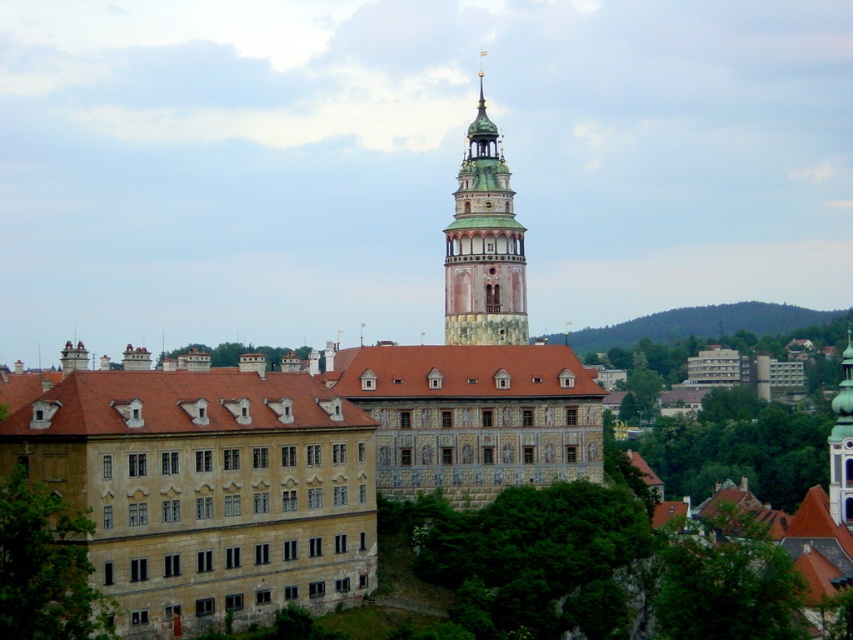
Question: Which object appears farthest from the camera in this image?

Choices:
 (A) green wooden bell tower at center
 (B) brown stone building at center
 (C) green grassy hillside at upper right

Answer: (C)

Question: Does green wooden bell tower at center appear under green grassy hillside at upper right?

Choices:
 (A) no
 (B) yes

Answer: (A)

Question: Can you confirm if green wooden bell tower at center is positioned to the left of green grassy hillside at upper right?

Choices:
 (A) no
 (B) yes

Answer: (B)

Question: Among these points, which one is farthest from the camera?

Choices:
 (A) (67, 408)
 (B) (665, 337)

Answer: (B)

Question: Which point is farther to the camera?

Choices:
 (A) (157, 417)
 (B) (488, 228)

Answer: (B)

Question: Does brown stone building at center appear on the left side of green wooden bell tower at center?

Choices:
 (A) yes
 (B) no

Answer: (B)